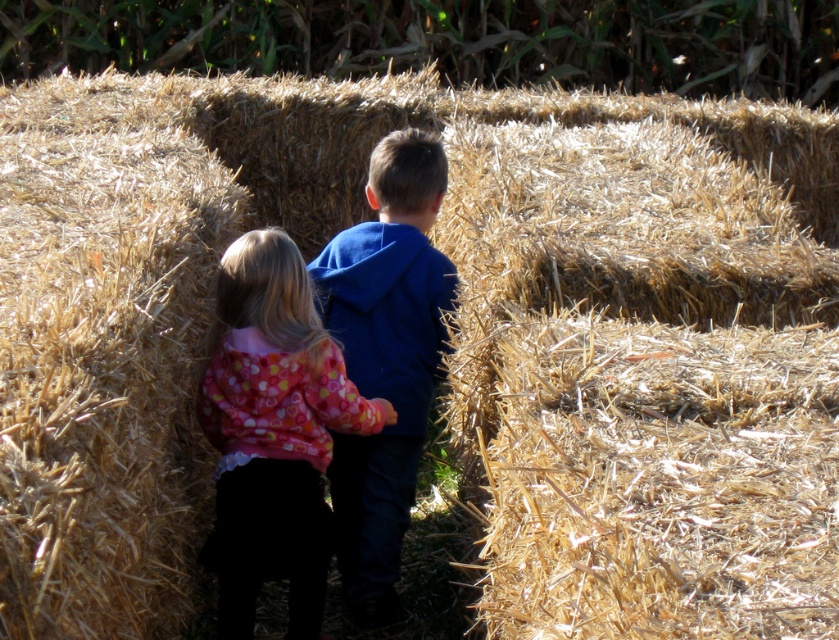
You are a photographer standing at the entrance of the hay maze. You want to take a photo of the floral fleece jacket at center. The camera you are using has a maximum focus range of 10 feet. Can you capture the jacket clearly with this camera?

The floral fleece jacket at center and camera are 12.22 feet apart from each other. Since the camera has a maximum focus range of 10 feet, it cannot capture the jacket clearly at this distance.

You are a photographer trying to capture both the floral fleece jacket at center and the blue fleece jacket at center in a single shot. Since you can only focus on one subject at a time, which jacket should you focus on to ensure the other remains in the background?

You should focus on the floral fleece jacket at center because it is in front of the blue fleece jacket at center, so the blue fleece jacket at center will naturally be in the background when the floral fleece jacket at center is in focus.

You are a photographer standing at the entrance of the hay maze. You want to capture a photo of both the floral fleece jacket at center and the blue fleece jacket at center in the same frame. The camera you are using has a maximum focus range of 15 inches. Can you take the photo without moving closer or farther away from the jackets?

The floral fleece jacket at center and blue fleece jacket at center are 18.04 inches apart from each other. Since the camera can only focus within 15 inches, the distance between them exceeds the focus range. Therefore, you cannot capture both jackets in focus without adjusting your position.